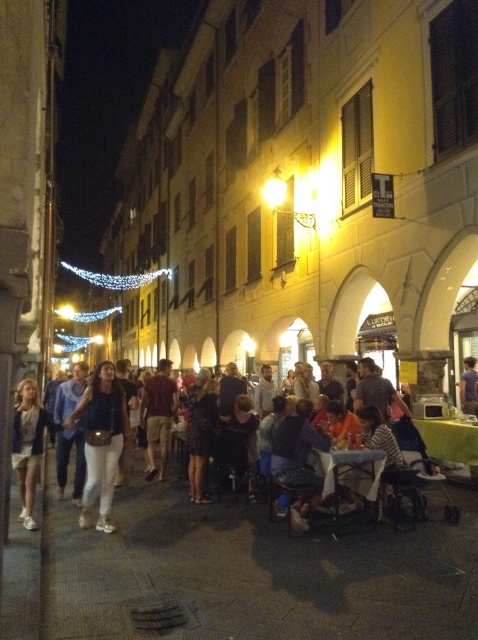
Is point (29, 528) positioned behind point (153, 396)?

No, it is in front of (153, 396).

Who is positioned more to the left, light beige denim jacket at lower left or brown textured shorts at center?

light beige denim jacket at lower left

Identify the location of light beige denim jacket at lower left. The height and width of the screenshot is (640, 478). (28, 445).

Can you confirm if dark blue jeans at center is bigger than light beige denim jacket at lower left?

Incorrect, dark blue jeans at center is not larger than light beige denim jacket at lower left.

Who is positioned more to the left, dark blue jeans at center or light beige denim jacket at lower left?

light beige denim jacket at lower left

Between point (86, 512) and point (23, 458), which one is positioned in front?

Point (86, 512) is in front.

The width and height of the screenshot is (478, 640). I want to click on dark blue jeans at center, so click(93, 436).

Can you confirm if matte black top at center is shorter than blue cotton shirt at center?

In fact, matte black top at center may be taller than blue cotton shirt at center.

Based on the photo, who is higher up, matte black top at center or blue cotton shirt at center?

blue cotton shirt at center

The width and height of the screenshot is (478, 640). Identify the location of matte black top at center. (100, 440).

Identify the location of matte black top at center. (100, 440).